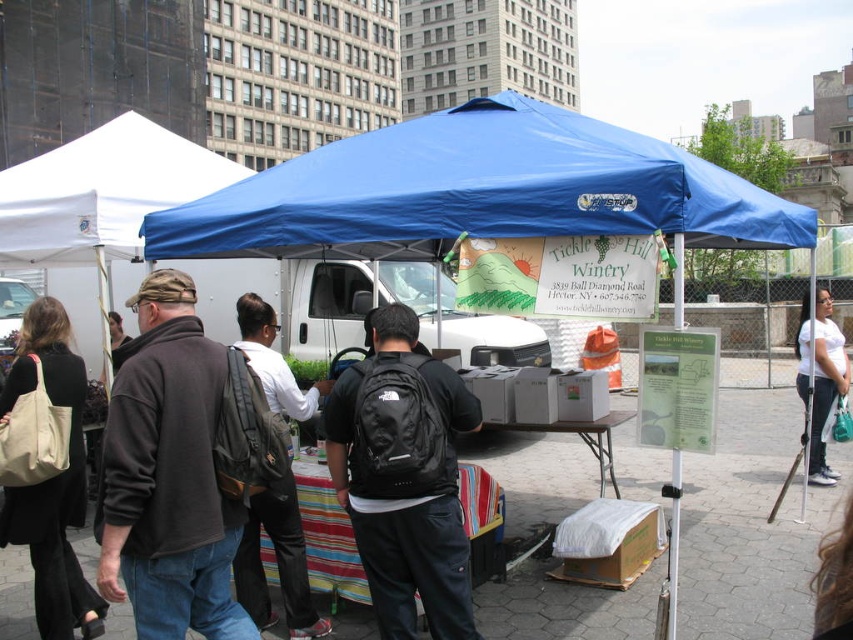
You are a photographer at the market and want to capture a photo of the blue fabric canopy at upper center and the white cotton shirt at lower right. Which object is above the other in the image?

The blue fabric canopy at upper center is positioned over the white cotton shirt at lower right, so the blue fabric canopy at upper center is above the white cotton shirt at lower right in the image.

You are a vendor at the Tickle Hill Winery booth. You need to place a new item on the table. The item requires a space that is wider than the black fabric backpack at center. Is there enough space next to the white fabric canopy at upper left?

The black fabric backpack at center is thinner than the white fabric canopy at upper left, so the space next to the white fabric canopy at upper left is wider than the backpack. Therefore, there is enough space to place the item next to the white fabric canopy at upper left.

From the picture: You are at the market and want to know if your small bag can fit into the space between the black fabric backpack at center and the white fabric canopy at upper left. Can it fit?

The black fabric backpack at center is smaller than the white fabric canopy at upper left, so there should be enough space for your small bag between them.